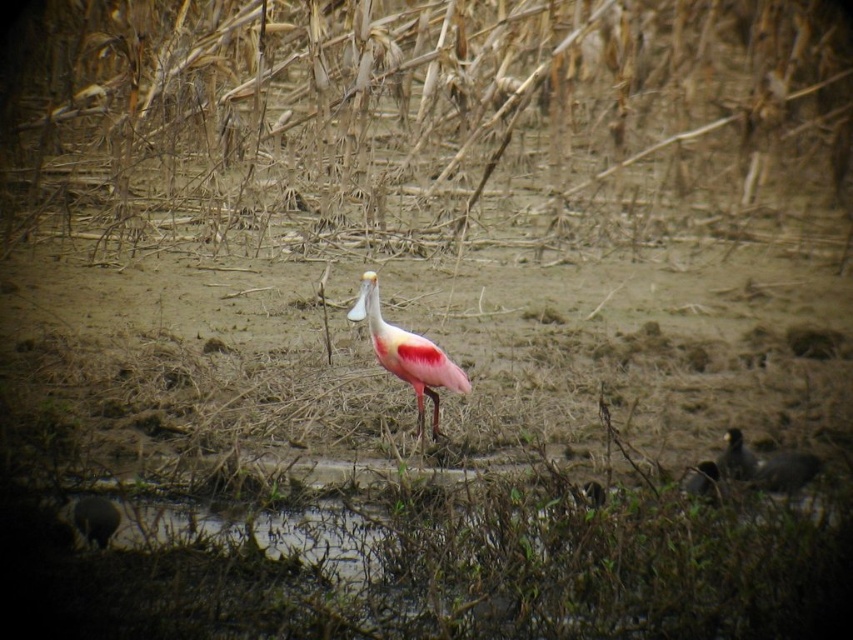
Which is more to the right, pink matte spoonbill at center or pink feathered bird at center?

pink feathered bird at center is more to the right.

Between pink matte spoonbill at center and pink feathered bird at center, which one has less height?

pink feathered bird at center is shorter.

The height and width of the screenshot is (640, 853). I want to click on pink matte spoonbill at center, so click(407, 355).

Who is positioned more to the left, brown dry reed at center or pink matte spoonbill at center?

pink matte spoonbill at center is more to the left.

Between brown dry reed at center and pink matte spoonbill at center, which one appears on the right side from the viewer's perspective?

brown dry reed at center

Does point (741, 118) lie behind point (421, 440)?

Yes, it is behind point (421, 440).

Find the location of a particular element. The image size is (853, 640). brown dry reed at center is located at coordinates (409, 116).

Does brown dry reed at center have a larger size compared to pink feathered bird at lower right?

Yes, brown dry reed at center is bigger than pink feathered bird at lower right.

Is brown dry reed at center shorter than pink feathered bird at lower right?

No, brown dry reed at center is not shorter than pink feathered bird at lower right.

Locate an element on the screen. Image resolution: width=853 pixels, height=640 pixels. brown dry reed at center is located at coordinates (409, 116).